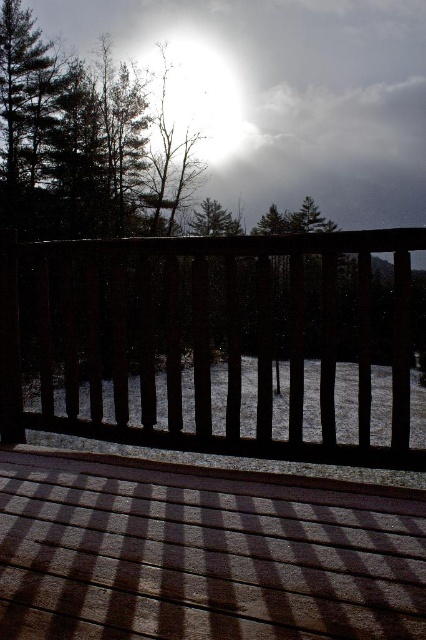
You are standing on the brown wooden deck at center and want to walk towards the green matte tree at center. Considering their widths, which path would require more careful navigation?

The brown wooden deck at center has a lesser width compared to the green matte tree at center, so navigating the path to the brown wooden deck at center requires more careful attention due to its narrower width.

You are standing on the brown wooden deck at center and looking towards the bright white light at upper center. Which object is closer to your eyes?

The brown wooden deck at center is closer to your eyes because it is shorter than the bright white light at upper center, meaning the deck is physically nearer to your position on the deck.